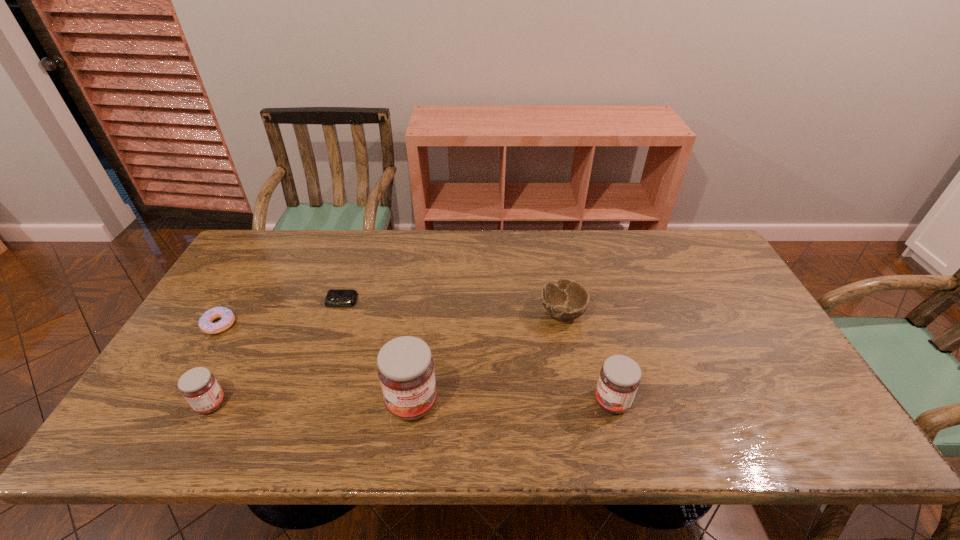
With all jams evenly spaced, where should an extra jam be placed on the right to continue the pattern? Please point out a vacant space. Please provide its 2D coordinates. Your answer should be formatted as a tuple, i.e. [(x, y)], where the tuple contains the x and y coordinates of a point satisfying the conditions above.

[(811, 400)]